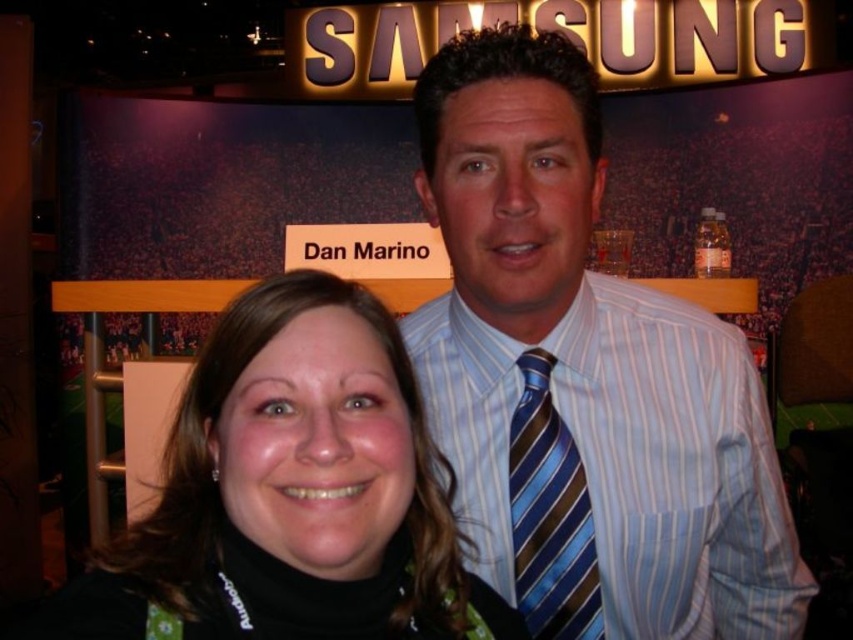
You are at a Samsung event where Dan Marino is present. You see a blue striped shirt at center and a black matte hair at center. Which object is located to the right of the other?

The blue striped shirt at center is positioned on the right side of black matte hair at center.

You are a photographer at the event and need to adjust the lighting so that both the black matte hair at center and the blue striped tie at center are equally visible. Since one is taller than the other, where should you position the light source to ensure both are illuminated properly?

The black matte hair at center is taller than the blue striped tie at center. To ensure both are equally visible, position the light source above the taller object so that it illuminates both objects evenly. In this case, place the light source above the black matte hair at center.